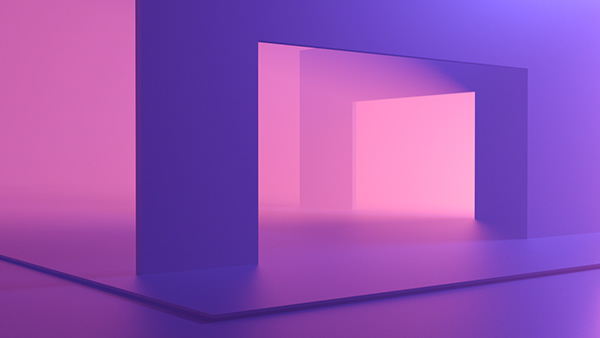
Identify the location of lip of heightened floor section. The height and width of the screenshot is (338, 600). (287, 305).